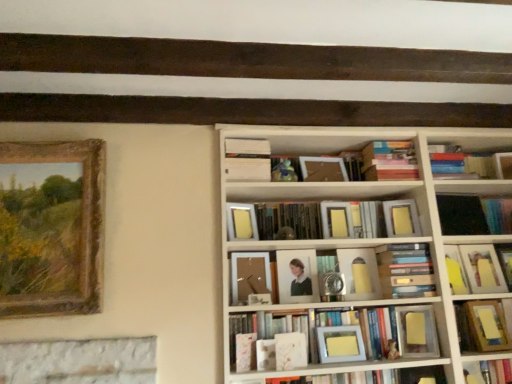
Question: In which direction should I rotate to look at white matte book at center, the 2th book viewed from the top?

Choices:
 (A) right
 (B) left

Answer: (B)

Question: From a real-world perspective, is hardcover book at center, which ranks as the sixth book in bottom-to-top order, beneath black matte book at right, acting as the third book starting from the top?

Choices:
 (A) yes
 (B) no

Answer: (A)

Question: From the image's perspective, is hardcover book at center, positioned as the 5th book in top-to-bottom order, on black matte book at right, acting as the third book starting from the top?

Choices:
 (A) yes
 (B) no

Answer: (B)

Question: Is hardcover book at center, positioned as the 5th book in top-to-bottom order, thinner than black matte book at right, acting as the third book starting from the top?

Choices:
 (A) yes
 (B) no

Answer: (B)

Question: Can you confirm if hardcover book at center, which ranks as the sixth book in bottom-to-top order, is wider than black matte book at right, acting as the third book starting from the top?

Choices:
 (A) no
 (B) yes

Answer: (B)

Question: Considering the relative sizes of hardcover book at center, positioned as the 5th book in top-to-bottom order, and black matte book at right, the 8th book when ordered from bottom to top, in the image provided, is hardcover book at center, positioned as the 5th book in top-to-bottom order, shorter than black matte book at right, the 8th book when ordered from bottom to top,?

Choices:
 (A) yes
 (B) no

Answer: (A)

Question: Is hardcover book at center, which ranks as the sixth book in bottom-to-top order, turned away from black matte book at right, the 8th book when ordered from bottom to top?

Choices:
 (A) yes
 (B) no

Answer: (B)

Question: From a real-world perspective, does yellow paper at upper right, which is counted as the 6th book, starting from the top, sit lower than gold-framed painting at left, which is the 4th picture frame from right to left?

Choices:
 (A) no
 (B) yes

Answer: (B)

Question: Is yellow paper at upper right, the fifth book positioned from the bottom, thinner than gold-framed painting at left, placed as the first picture frame when sorted from left to right?

Choices:
 (A) no
 (B) yes

Answer: (B)

Question: Can you confirm if yellow paper at upper right, the fifth book positioned from the bottom, is wider than gold-framed painting at left, which is the 4th picture frame from right to left?

Choices:
 (A) yes
 (B) no

Answer: (B)

Question: From the image's perspective, is yellow paper at upper right, the fifth book positioned from the bottom, located beneath gold-framed painting at left, placed as the first picture frame when sorted from left to right?

Choices:
 (A) yes
 (B) no

Answer: (A)

Question: Is yellow paper at upper right, the fifth book positioned from the bottom, behind gold-framed painting at left, placed as the first picture frame when sorted from left to right?

Choices:
 (A) no
 (B) yes

Answer: (B)

Question: Does yellow paper at upper right, which is counted as the 6th book, starting from the top, come in front of gold-framed painting at left, placed as the first picture frame when sorted from left to right?

Choices:
 (A) yes
 (B) no

Answer: (B)

Question: Is gold-framed painting at left, which is the 4th picture frame from right to left, smaller than matte white frame at center, which is the 8th book in top-to-bottom order?

Choices:
 (A) yes
 (B) no

Answer: (B)